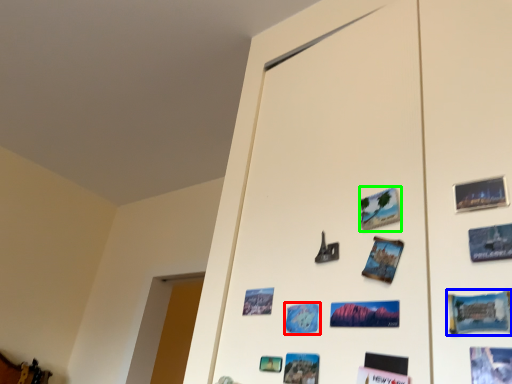
Question: Considering the real-world distances, which object is farthest from postcard (highlighted by a red box)? postcard (highlighted by a blue box) or postcard (highlighted by a green box)?

Choices:
 (A) postcard
 (B) postcard

Answer: (A)